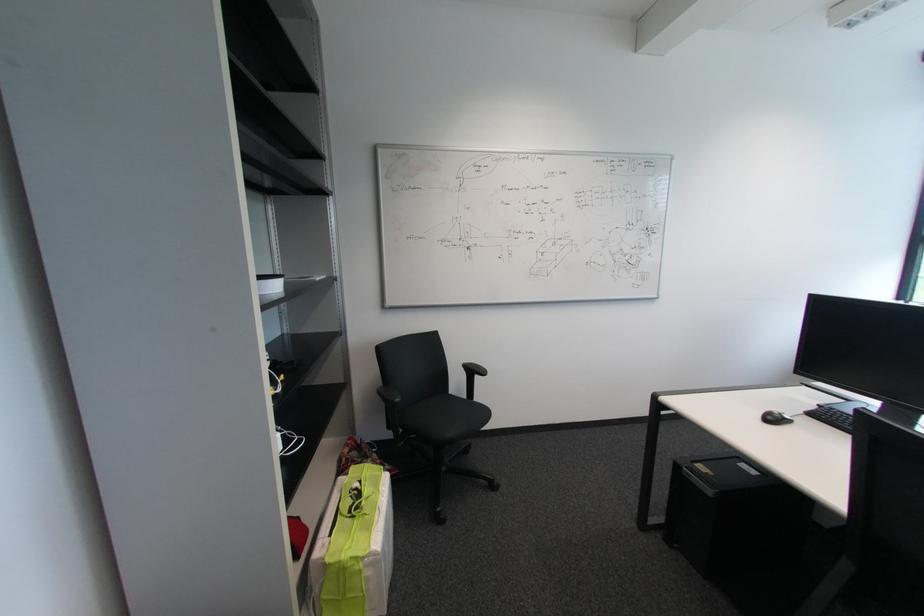
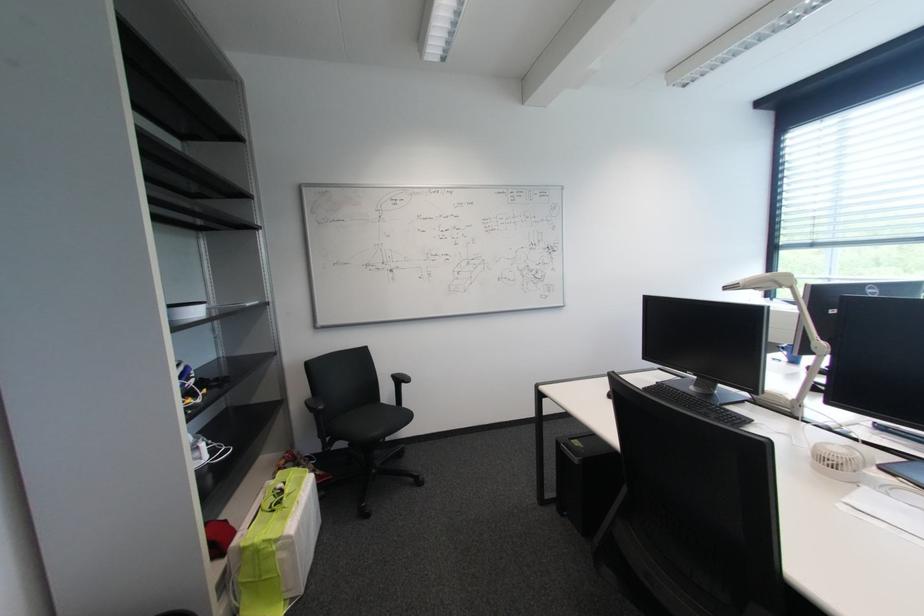
What movement of the cameraman would produce the second image?

The cameraman walked toward right, backward.